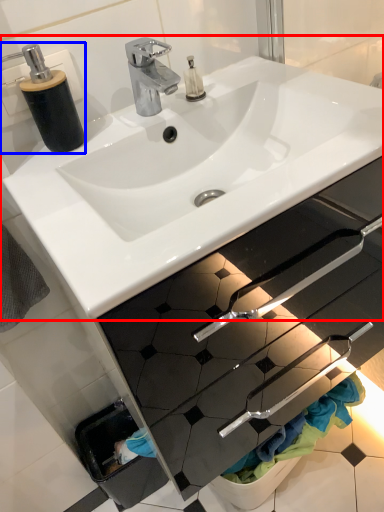
Question: Which object appears farthest to the camera in this image, sink (highlighted by a red box) or soap dispenser (highlighted by a blue box)?

Choices:
 (A) sink
 (B) soap dispenser

Answer: (B)